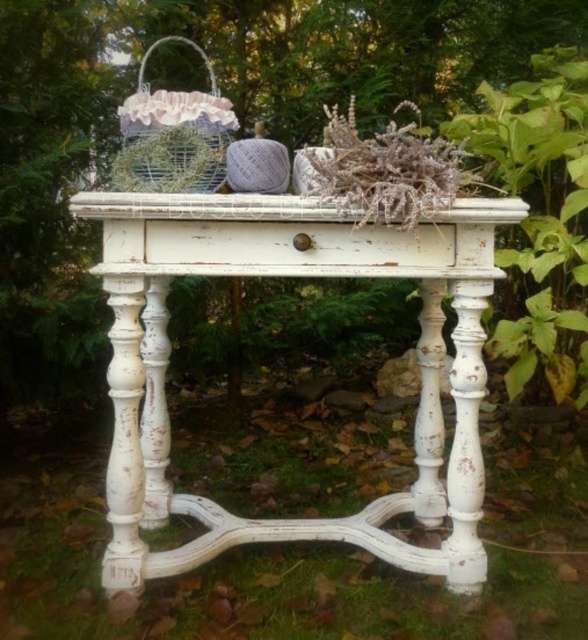
Which of these two, white distressed wood table at center or metallic wire basket at upper left, stands shorter?

metallic wire basket at upper left is shorter.

Between white distressed wood table at center and metallic wire basket at upper left, which one is positioned lower?

white distressed wood table at center is below.

This screenshot has width=588, height=640. Identify the location of white distressed wood table at center. (303, 276).